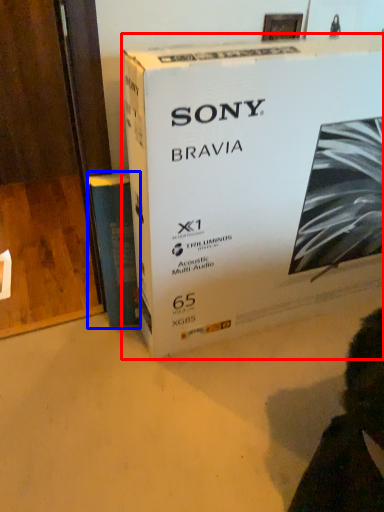
Question: Which object is further to the camera taking this photo, box (highlighted by a red box) or paperback book (highlighted by a blue box)?

Choices:
 (A) box
 (B) paperback book

Answer: (B)